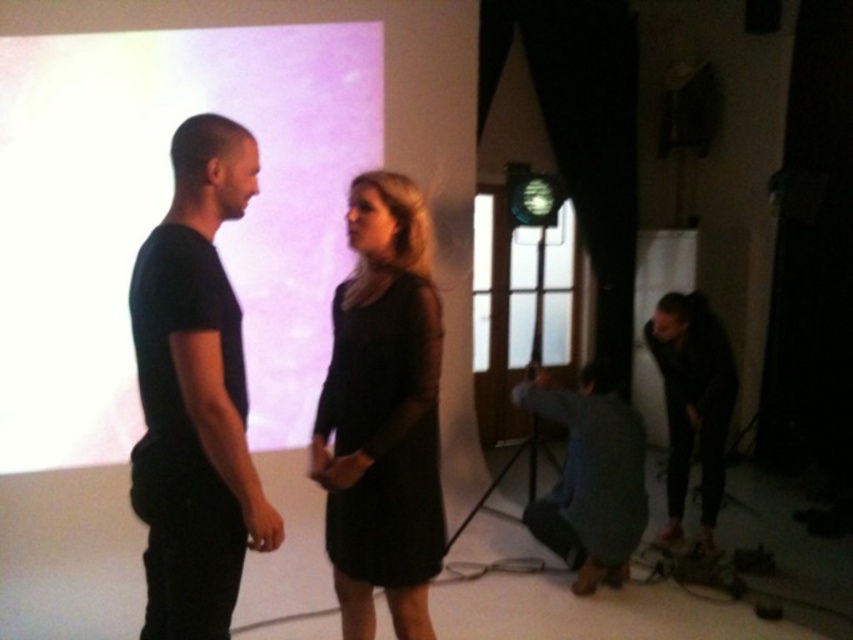
You are a photographer setting up a shoot in this studio. You need to ensure that the white matte projection screen at upper left and the black matte dress at center are both visible in the frame. Given their heights, which object will require you to adjust your camera angle upwards more to capture properly?

The white matte projection screen at upper left has a greater height compared to the black matte dress at center, so you will need to adjust your camera angle upwards more to capture the white matte projection screen at upper left properly.

In the photography studio scene with the white and pink backdrop, where exactly is the black matte dress at center located in terms of coordinates?

The black matte dress at center is located at coordinates point (386, 435).

You are a photographer in the studio and want to ensure the black matte dress at center is fully visible in the photo. Considering the white matte projection screen at upper left, which object might be causing a glare or reflection issue and why?

The white matte projection screen at upper left is positioned over the black matte dress at center, so it might be causing a glare or reflection issue because its bright white surface could reflect light onto the dress, making it harder to capture details clearly.